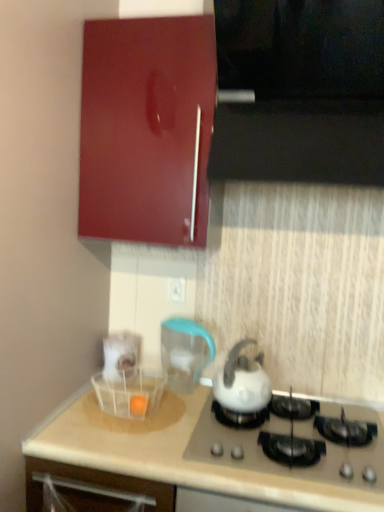
Question: Considering the relative sizes of glossy wood cabinet at upper left and white plastic drawer at lower left in the image provided, is glossy wood cabinet at upper left wider than white plastic drawer at lower left?

Choices:
 (A) yes
 (B) no

Answer: (A)

Question: Is glossy wood cabinet at upper left facing towards white plastic drawer at lower left?

Choices:
 (A) no
 (B) yes

Answer: (A)

Question: Is white plastic drawer at lower left located within glossy wood cabinet at upper left?

Choices:
 (A) no
 (B) yes

Answer: (A)

Question: Is glossy wood cabinet at upper left located outside white plastic drawer at lower left?

Choices:
 (A) yes
 (B) no

Answer: (A)

Question: Is glossy wood cabinet at upper left turned away from white plastic drawer at lower left?

Choices:
 (A) no
 (B) yes

Answer: (A)

Question: Based on their positions, is white glossy kettle at center located to the left or right of transparent plastic basket at lower center?

Choices:
 (A) right
 (B) left

Answer: (A)

Question: Is white glossy kettle at center wider or thinner than transparent plastic basket at lower center?

Choices:
 (A) wide
 (B) thin

Answer: (A)

Question: From the image's perspective, is white glossy kettle at center above or below transparent plastic basket at lower center?

Choices:
 (A) below
 (B) above

Answer: (B)

Question: Relative to transparent plastic basket at lower center, is white glossy kettle at center in front or behind?

Choices:
 (A) behind
 (B) front

Answer: (B)

Question: Based on their positions, is transparent plastic blender at center located to the left or right of white glossy gas stove at lower center?

Choices:
 (A) left
 (B) right

Answer: (A)

Question: From a real-world perspective, is transparent plastic blender at center physically located above or below white glossy gas stove at lower center?

Choices:
 (A) above
 (B) below

Answer: (A)

Question: Based on their sizes in the image, would you say transparent plastic blender at center is bigger or smaller than white glossy gas stove at lower center?

Choices:
 (A) small
 (B) big

Answer: (A)

Question: In terms of width, does transparent plastic blender at center look wider or thinner when compared to white glossy gas stove at lower center?

Choices:
 (A) wide
 (B) thin

Answer: (B)

Question: From a real-world perspective, relative to black glossy vent at upper center, is white glossy kettle at center vertically above or below?

Choices:
 (A) above
 (B) below

Answer: (B)

Question: From their relative heights in the image, would you say white glossy kettle at center is taller or shorter than black glossy vent at upper center?

Choices:
 (A) tall
 (B) short

Answer: (B)